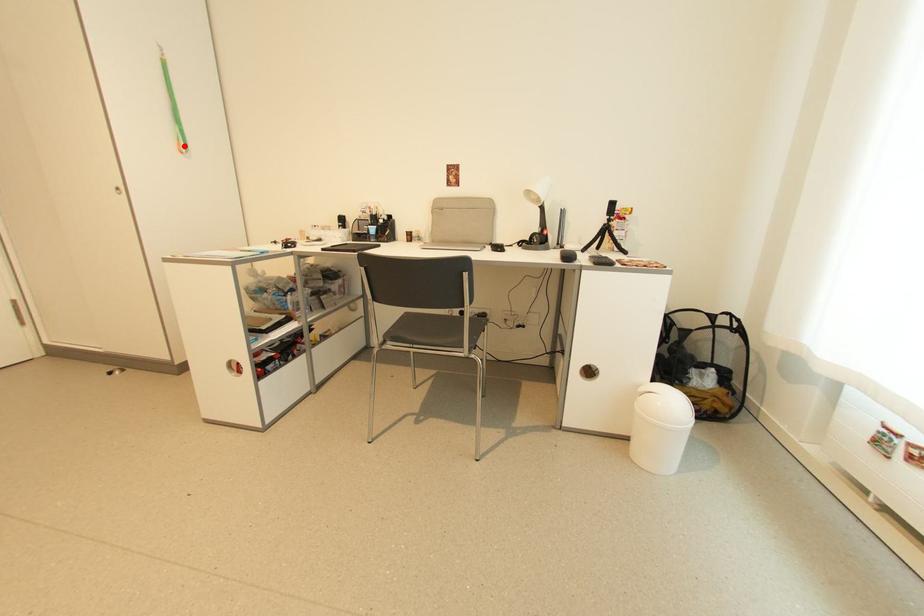
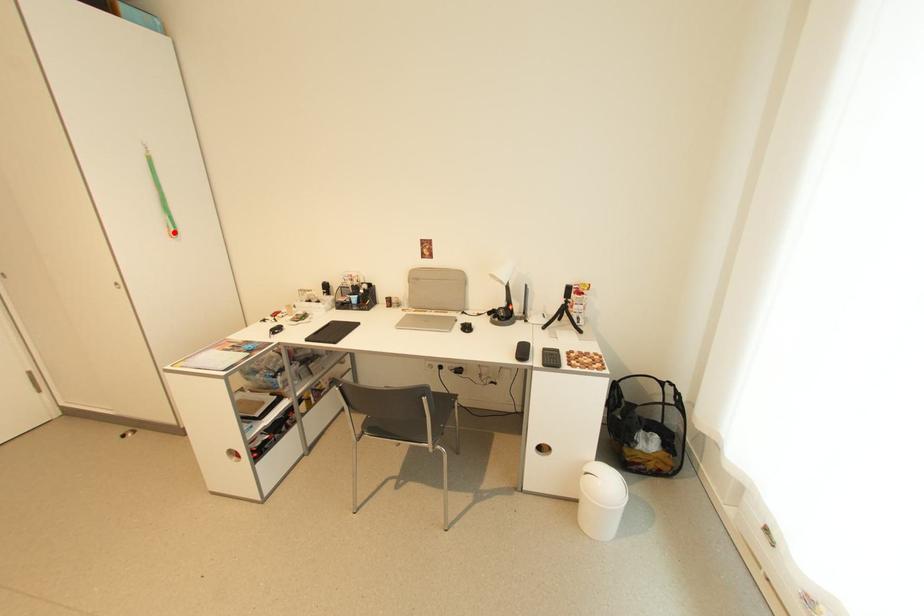
I am providing you with two images of the same scene from different viewpoints. A red point is marked on the first image and another point is marked on the second image. Do the highlighted points in image1 and image2 indicate the same real-world spot?

Yes